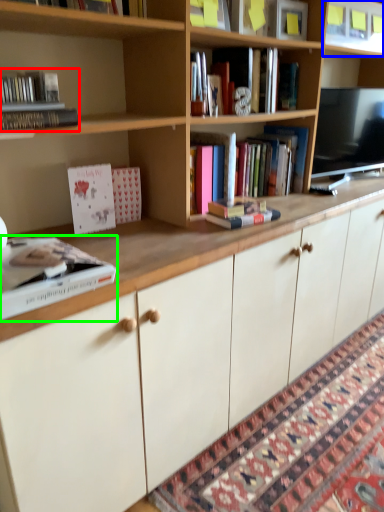
Question: Considering the real-world distances, which object is closest to book (highlighted by a red box)? shelf (highlighted by a blue box) or book (highlighted by a green box).

Choices:
 (A) shelf
 (B) book

Answer: (B)